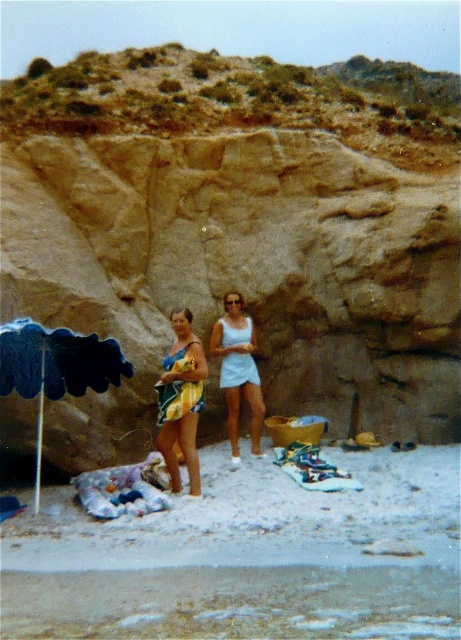
You are planning to set up a picnic area on the beach. You have a blue fabric umbrella at left and a light blue fabric dress at center. Which item would provide more shade coverage for your picnic setup?

The blue fabric umbrella at left has a larger size compared to the light blue fabric dress at center, so it would provide more shade coverage for the picnic setup.

Looking at this image, you are planning to set up a picnic on the beach. The white sand at lower center and the blue fabric umbrella at left are in your way. Which object takes up more space?

The blue fabric umbrella at left takes up more space than the white sand at lower center because the white sand at lower center is smaller than the blue fabric umbrella at left.

You are a photographer trying to capture a photo of the brown rock cliff at center and the light blue fabric dress at center. Which object should you focus on first if you want to ensure both are in sharp focus?

The brown rock cliff at center is taller than the light blue fabric dress at center, so you should focus on the brown rock cliff at center first to ensure both are in sharp focus.